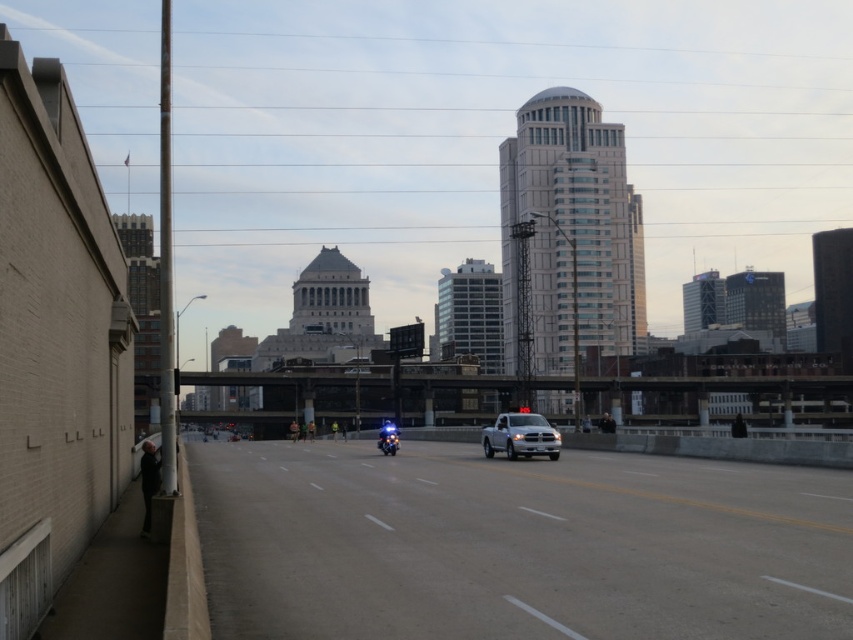
Question: Among these points, which one is farthest from the camera?

Choices:
 (A) (801, 387)
 (B) (492, 449)

Answer: (A)

Question: Is metallic gray bridge at center wider than white matte truck at center?

Choices:
 (A) no
 (B) yes

Answer: (B)

Question: Which object is farther from the camera taking this photo?

Choices:
 (A) gray asphalt highway at center
 (B) white matte truck at center
 (C) metallic gray bridge at center
 (D) shiny blue motorcycle at center

Answer: (D)

Question: Is metallic gray bridge at center below shiny blue motorcycle at center?

Choices:
 (A) no
 (B) yes

Answer: (A)

Question: Does metallic gray bridge at center have a smaller size compared to shiny blue motorcycle at center?

Choices:
 (A) yes
 (B) no

Answer: (B)

Question: Which point is farther to the camera?

Choices:
 (A) white matte truck at center
 (B) shiny blue motorcycle at center

Answer: (B)